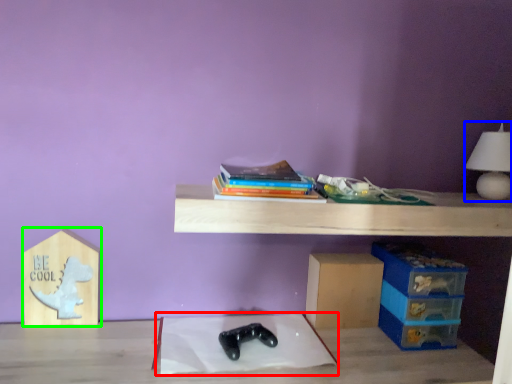
Question: Considering the real-world distances, which object is farthest from sheet (highlighted by a red box)? table lamp (highlighted by a blue box) or cardboard box (highlighted by a green box)?

Choices:
 (A) table lamp
 (B) cardboard box

Answer: (A)